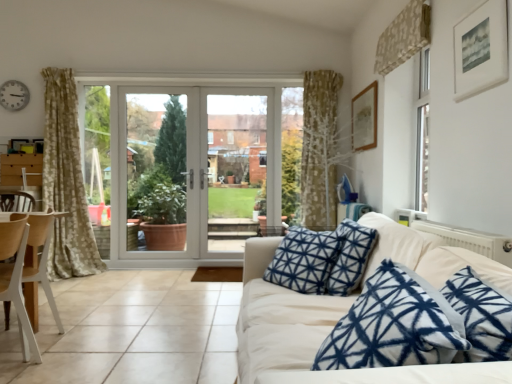
Question: Is white plastic clock at upper left positioned beyond the bounds of white wood chair at lower left?

Choices:
 (A) no
 (B) yes

Answer: (B)

Question: Can you confirm if white plastic clock at upper left is bigger than white wood chair at lower left?

Choices:
 (A) no
 (B) yes

Answer: (A)

Question: Does white plastic clock at upper left have a greater height compared to white wood chair at lower left?

Choices:
 (A) yes
 (B) no

Answer: (B)

Question: Can you confirm if white plastic clock at upper left is positioned to the left of white wood chair at lower left?

Choices:
 (A) no
 (B) yes

Answer: (B)

Question: Is white plastic clock at upper left directly adjacent to white wood chair at lower left?

Choices:
 (A) yes
 (B) no

Answer: (B)

Question: Is white glossy door at center in front of or behind clear glass door at center in the image?

Choices:
 (A) behind
 (B) front

Answer: (A)

Question: Does point (216, 119) appear closer or farther from the camera than point (268, 104)?

Choices:
 (A) closer
 (B) farther

Answer: (B)

Question: Considering the positions of white glossy door at center and clear glass door at center in the image, is white glossy door at center wider or thinner than clear glass door at center?

Choices:
 (A) wide
 (B) thin

Answer: (A)

Question: Based on their positions, is white glossy door at center located to the left or right of clear glass door at center?

Choices:
 (A) right
 (B) left

Answer: (B)

Question: Would you say wooden picture frame at upper right, arranged as the second picture frame when viewed from the front, is inside or outside clear glass door at center?

Choices:
 (A) inside
 (B) outside

Answer: (B)

Question: From the image's perspective, relative to clear glass door at center, is wooden picture frame at upper right, arranged as the second picture frame when viewed from the front, above or below?

Choices:
 (A) below
 (B) above

Answer: (B)

Question: Would you say wooden picture frame at upper right, placed as the first picture frame when sorted from back to front, is to the left or to the right of clear glass door at center in the picture?

Choices:
 (A) left
 (B) right

Answer: (B)

Question: From a real-world perspective, is wooden picture frame at upper right, arranged as the second picture frame when viewed from the front, positioned above or below clear glass door at center?

Choices:
 (A) below
 (B) above

Answer: (B)

Question: Is white wood chair at lower left inside or outside of white plastic clock at upper left?

Choices:
 (A) outside
 (B) inside

Answer: (A)

Question: Considering the positions of white wood chair at lower left and white plastic clock at upper left in the image, is white wood chair at lower left wider or thinner than white plastic clock at upper left?

Choices:
 (A) wide
 (B) thin

Answer: (A)